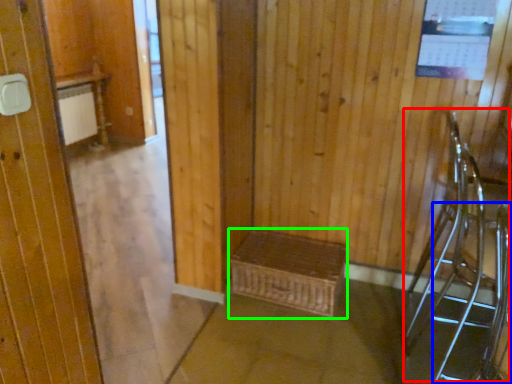
Question: Considering the real-world distances, which object is farthest from armchair (highlighted by a red box)? armchair (highlighted by a blue box) or furniture (highlighted by a green box)?

Choices:
 (A) armchair
 (B) furniture

Answer: (B)